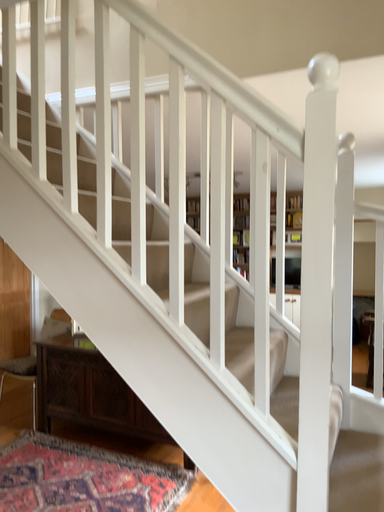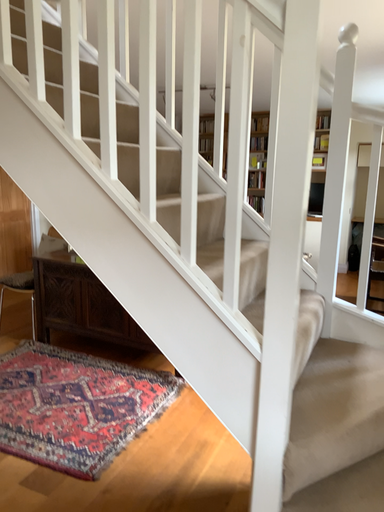
Question: How did the camera likely rotate when shooting the video?

Choices:
 (A) rotated downward
 (B) rotated upward

Answer: (A)